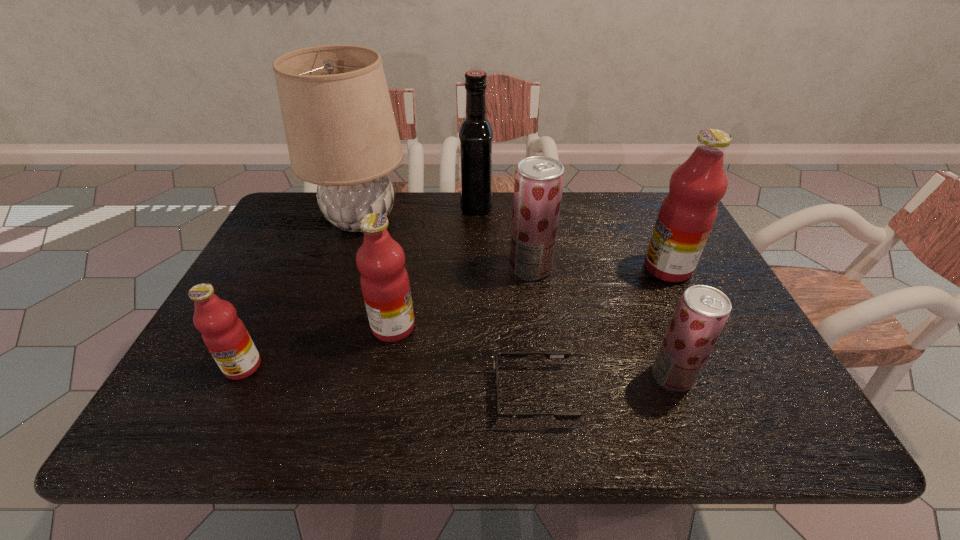
You are a GUI agent. You are given a task and a screenshot of the screen. Output one action in this format:
    pyautogui.click(x=<x>, y=<y>)
    Task: Click on the nearest pink fruit juice
    The width and height of the screenshot is (960, 540).
    Given the screenshot: What is the action you would take?
    pyautogui.click(x=224, y=334)

In order to click on the smallest pink fruit juice in this screenshot , I will do `click(224, 334)`.

The image size is (960, 540). In order to click on the shortest object in this screenshot , I will do `click(549, 355)`.

Locate an element on the screen. This screenshot has height=540, width=960. vacant point located 0.390m on the front of the lampshade is located at coordinates (311, 362).

Identify the location of vacant space located on the front-facing side of the black liquor. This screenshot has width=960, height=540. (599, 205).

Locate an element on the screen. This screenshot has height=540, width=960. free space located 0.400m on the label of the biggest pink fruit juice is located at coordinates (494, 268).

The image size is (960, 540). I want to click on blank area located 0.340m on the label of the biggest pink fruit juice, so click(x=516, y=268).

Locate an element on the screen. This screenshot has width=960, height=540. vacant region located on the label of the biggest pink fruit juice is located at coordinates (562, 268).

Where is `vacant region located 0.050m on the back of the left strawberry fruit juice`? The height and width of the screenshot is (540, 960). vacant region located 0.050m on the back of the left strawberry fruit juice is located at coordinates (527, 244).

The height and width of the screenshot is (540, 960). I want to click on free region located 0.080m on the label of the fourth nearest object, so click(x=449, y=327).